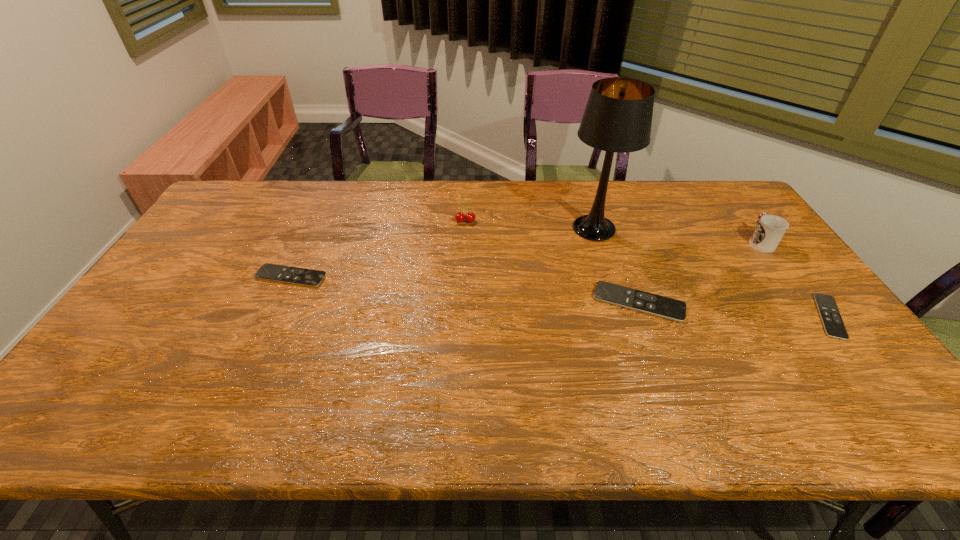
At what (x,y) coordinates should I click in order to perform the action: click on cup positioned at the right edge. Please return your answer as a coordinate pair (x, y). The image size is (960, 540). Looking at the image, I should click on (770, 229).

This screenshot has height=540, width=960. I want to click on free space at the far edge, so click(433, 195).

At what (x,y) coordinates should I click in order to perform the action: click on vacant space at the near edge of the desktop. Please return your answer as a coordinate pair (x, y). This screenshot has width=960, height=540. Looking at the image, I should click on [x=307, y=386].

What are the coordinates of `vacant space at the left edge of the desktop` in the screenshot? It's located at (187, 295).

Locate an element on the screen. The width and height of the screenshot is (960, 540). free space at the right edge of the desktop is located at coordinates (773, 314).

In the image, there is a desktop. Identify the location of vacant space at the far left corner. The width and height of the screenshot is (960, 540). (259, 186).

I want to click on free space at the near left corner of the desktop, so 115,357.

In the image, there is a desktop. At what (x,y) coordinates should I click in order to perform the action: click on vacant space at the far right corner. Please return your answer as a coordinate pair (x, y). The image size is (960, 540). Looking at the image, I should click on (691, 180).

The width and height of the screenshot is (960, 540). I want to click on empty space between the leftmost remote control and the tallest object, so click(x=443, y=252).

Locate an element on the screen. The width and height of the screenshot is (960, 540). free area in between the fifth object from right to left and the second remote control from right to left is located at coordinates (552, 262).